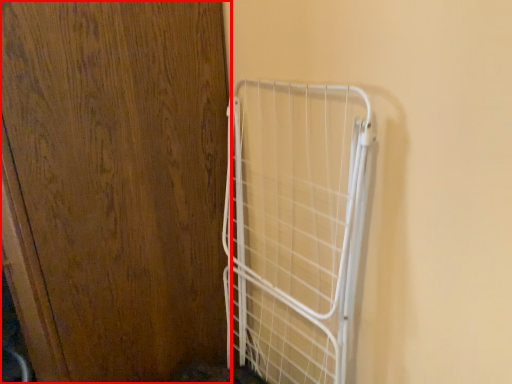
Question: From the image's perspective, where is door (annotated by the red box) located in relation to cage in the image?

Choices:
 (A) above
 (B) below

Answer: (A)